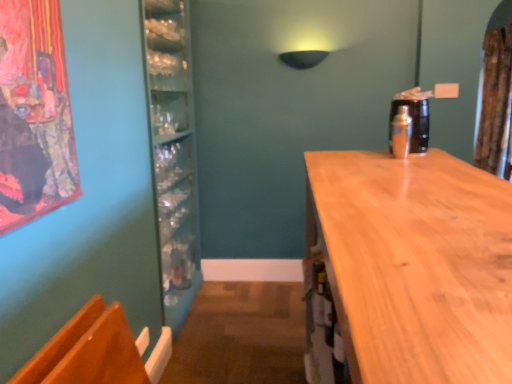
You are a GUI agent. You are given a task and a screenshot of the screen. Output one action in this format:
    pyautogui.click(x=<x>, y=<y>)
    Task: Click on the vacant area that is in front of shiny metallic shaker at right
    The image size is (512, 384).
    Given the screenshot: What is the action you would take?
    pyautogui.click(x=398, y=158)